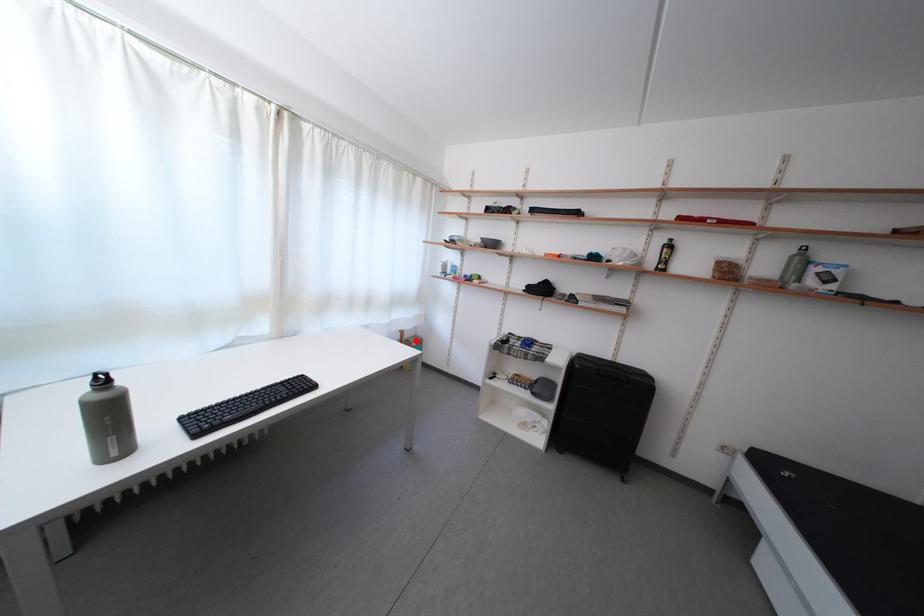
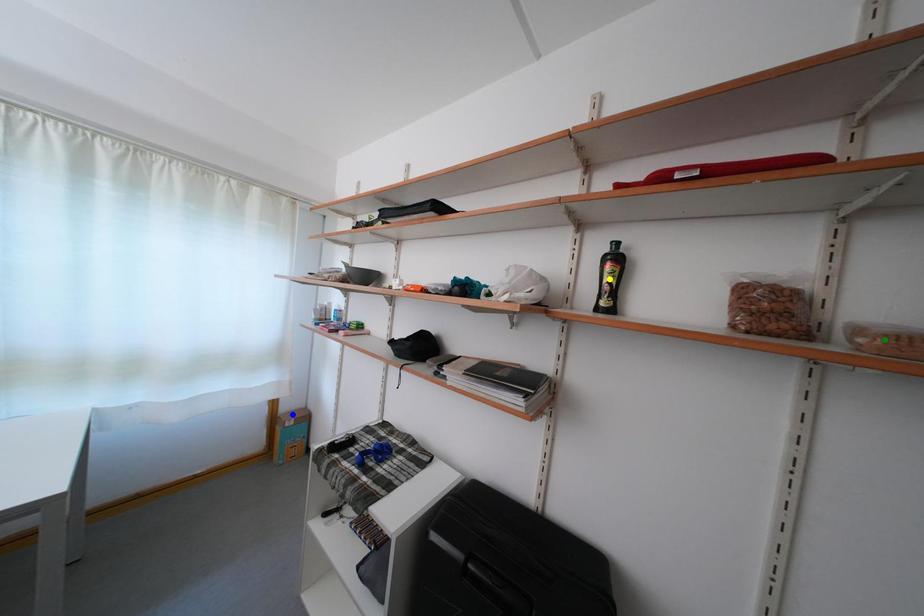
Question: I am providing you with two images of the same scene from different viewpoints. A red point is marked on the first image. You are given multiple points on the second image. Which mark in image 2 goes with the point in image 1?

Choices:
 (A) yellow point
 (B) green point
 (C) blue point

Answer: (C)